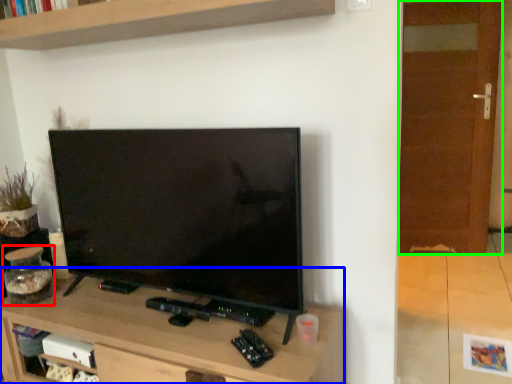
Question: Which is nearer to the glass jar (highlighted by a red box)? table (highlighted by a blue box) or glass door (highlighted by a green box).

Choices:
 (A) table
 (B) glass door

Answer: (A)